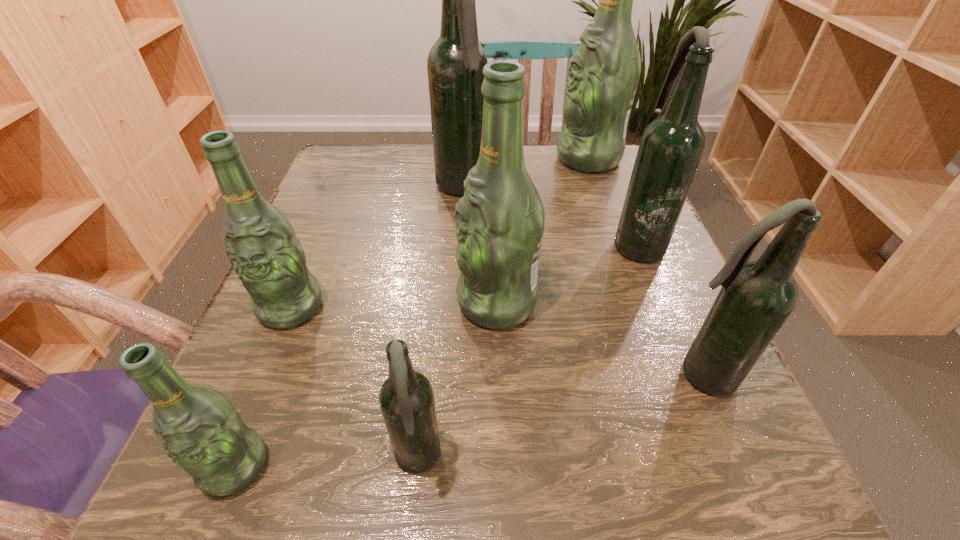
Find the location of a particular element. Image resolution: width=960 pixels, height=540 pixels. vacant area that satisfies the following two spatial constraints: 1. on the surface of the biggest green beer bottle; 2. on the back side of the sixth farthest beer bottle is located at coordinates (664, 375).

This screenshot has width=960, height=540. Find the location of `free space that satisfies the following two spatial constraints: 1. on the surface of the second biggest green beer bottle; 2. on the surface of the third biggest green beer bottle`. free space that satisfies the following two spatial constraints: 1. on the surface of the second biggest green beer bottle; 2. on the surface of the third biggest green beer bottle is located at coordinates (497, 307).